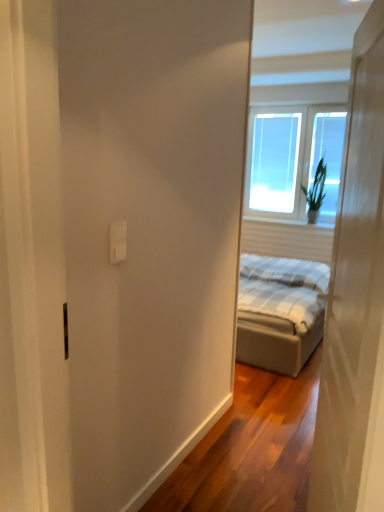
Question: Do you think green leafy plant at upper right is within transparent glass window at center, or outside of it?

Choices:
 (A) inside
 (B) outside

Answer: (B)

Question: Looking at their shapes, would you say green leafy plant at upper right is wider or thinner than transparent glass window at center?

Choices:
 (A) wide
 (B) thin

Answer: (A)

Question: Which object is positioned farthest from the white plastic outlet at upper center?

Choices:
 (A) transparent glass window at upper right
 (B) transparent glass window at center
 (C) white matte door at right
 (D) green leafy plant at upper right

Answer: (B)

Question: Based on their relative distances, which object is farther from the transparent glass window at upper right?

Choices:
 (A) white plastic outlet at upper center
 (B) transparent glass window at center
 (C) white matte door at right
 (D) green leafy plant at upper right

Answer: (A)